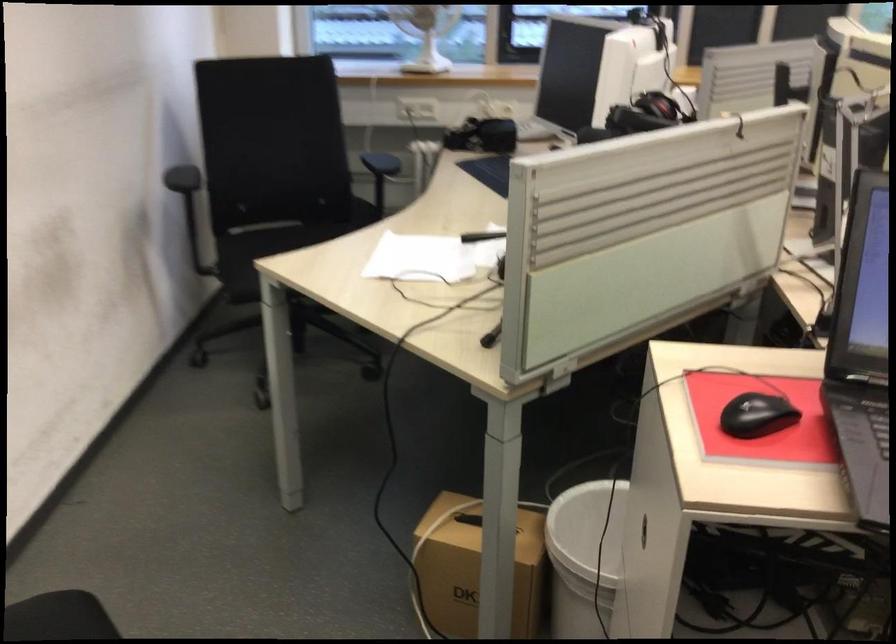
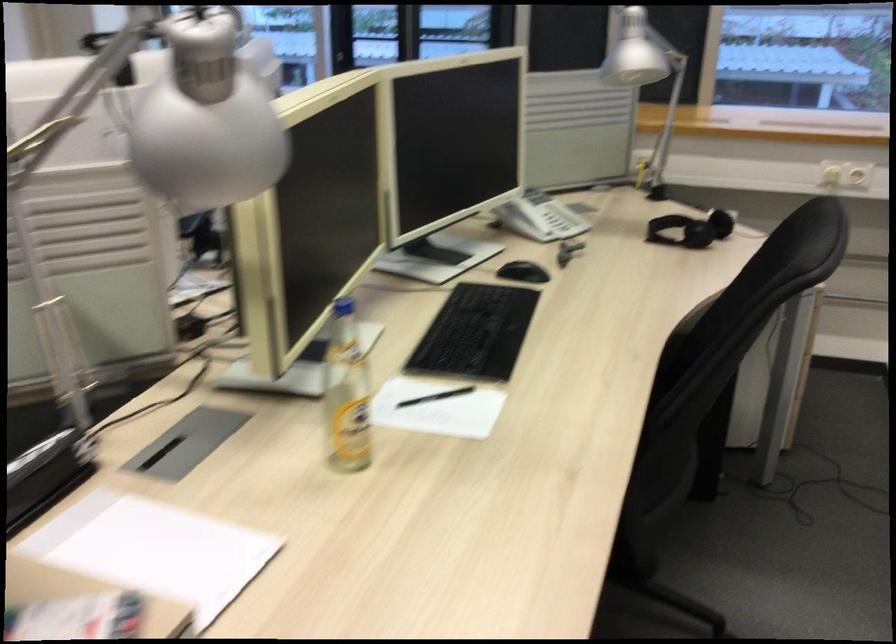
Question: Which direction would the cameraman need to move to produce the second image? Reply with the corresponding letter.

Choices:
 (A) Left
 (B) Right
 (C) Forward
 (D) Backward

Answer: (B)